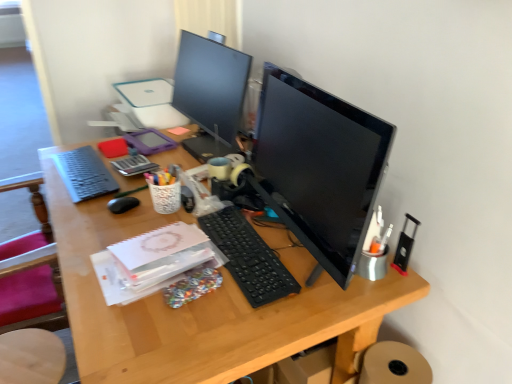
Where is `free point above black plastic keyboard at center, which is counted as the 2th computer keyboard, starting from the left (from a real-world perspective)`? Image resolution: width=512 pixels, height=384 pixels. free point above black plastic keyboard at center, which is counted as the 2th computer keyboard, starting from the left (from a real-world perspective) is located at coordinates (250, 249).